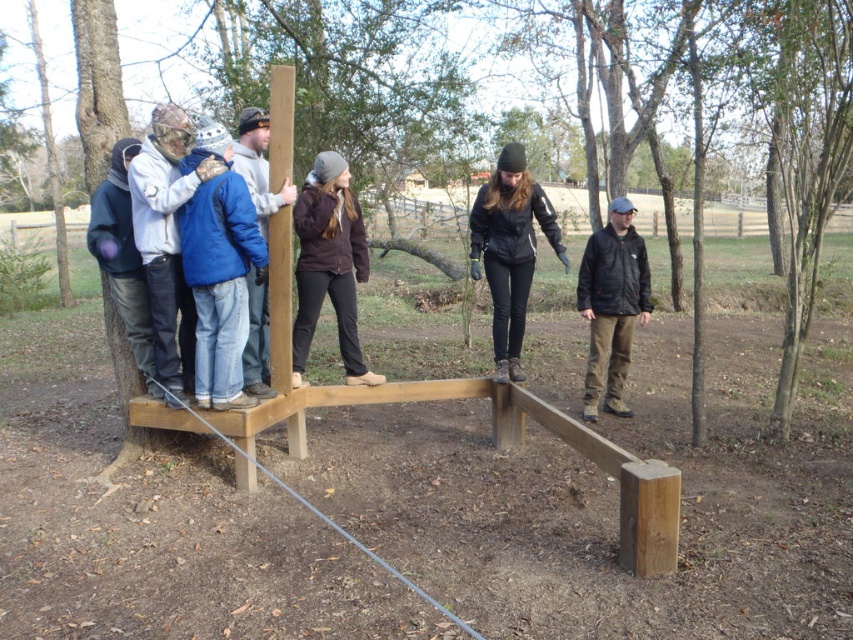
Between camouflage fabric jacket at left and dark blue fleece jacket at left, which one has less height?

dark blue fleece jacket at left is shorter.

Between point (157, 362) and point (120, 288), which one is positioned behind?

Positioned behind is point (120, 288).

The height and width of the screenshot is (640, 853). I want to click on camouflage fabric jacket at left, so click(167, 241).

Can you confirm if camouflage fabric jacket at left is positioned below black leather jacket at center?

Yes.

Between camouflage fabric jacket at left and black leather jacket at center, which one appears on the right side from the viewer's perspective?

Positioned to the right is black leather jacket at center.

Is point (158, 365) more distant than point (519, 212)?

No, (158, 365) is closer to viewer.

The image size is (853, 640). Find the location of `camouflage fabric jacket at left`. camouflage fabric jacket at left is located at coordinates (167, 241).

Does brown fuzzy jacket at center have a greater width compared to brown leather jacket at upper center?

Correct, the width of brown fuzzy jacket at center exceeds that of brown leather jacket at upper center.

Is brown fuzzy jacket at center above brown leather jacket at upper center?

Incorrect, brown fuzzy jacket at center is not positioned above brown leather jacket at upper center.

Identify the location of brown fuzzy jacket at center. This screenshot has width=853, height=640. (329, 266).